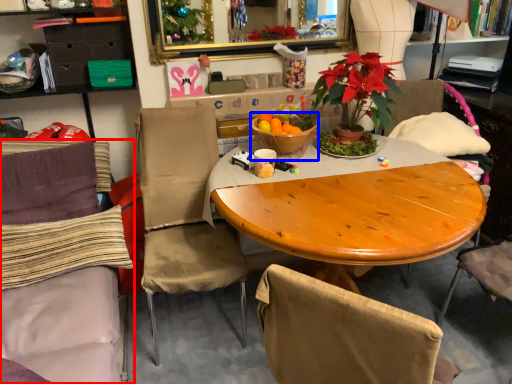
Question: Which object is closer to the camera taking this photo, chair (highlighted by a red box) or tableware (highlighted by a blue box)?

Choices:
 (A) chair
 (B) tableware

Answer: (A)